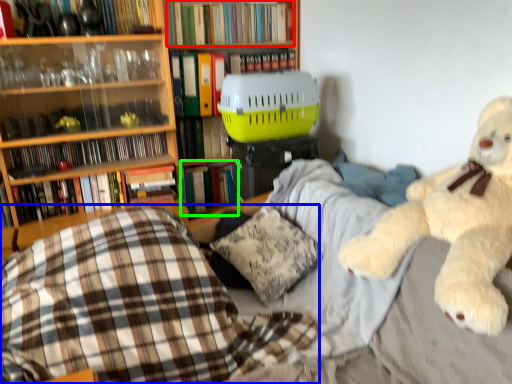
Question: Which is farther away from book (highlighted by a red box)? plaid (highlighted by a blue box) or book (highlighted by a green box)?

Choices:
 (A) plaid
 (B) book

Answer: (A)